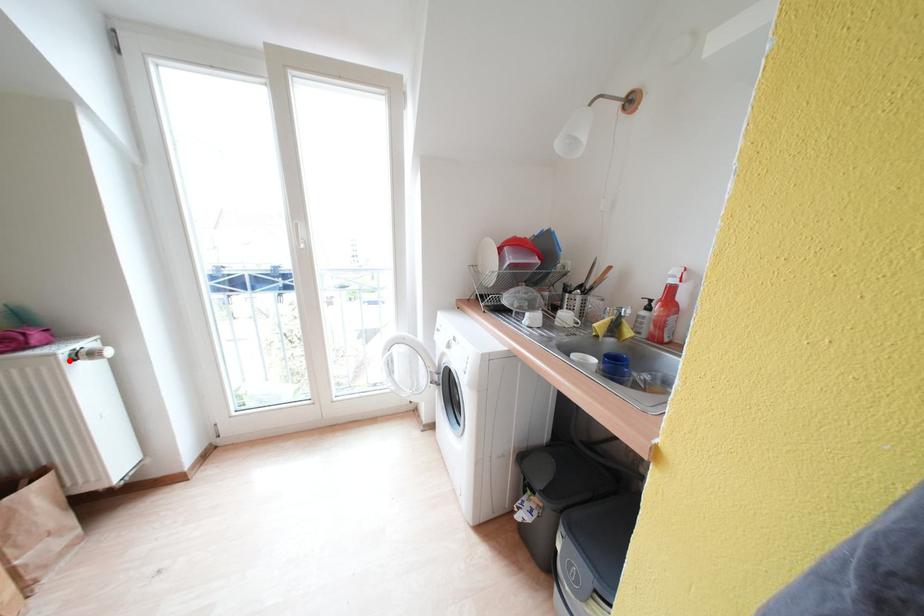
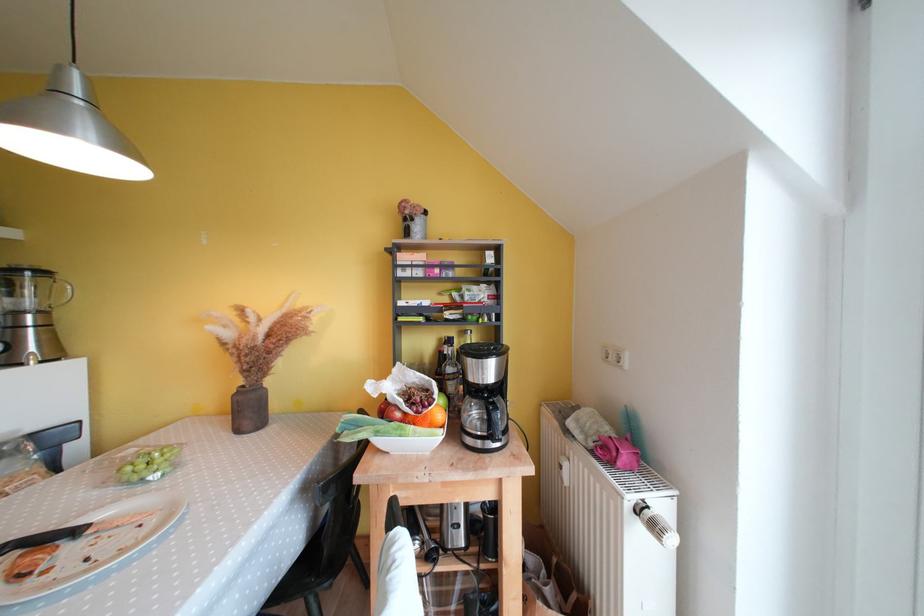
The point at the highlighted location is marked in the first image. Where is the corresponding point in the second image?

(634, 509)